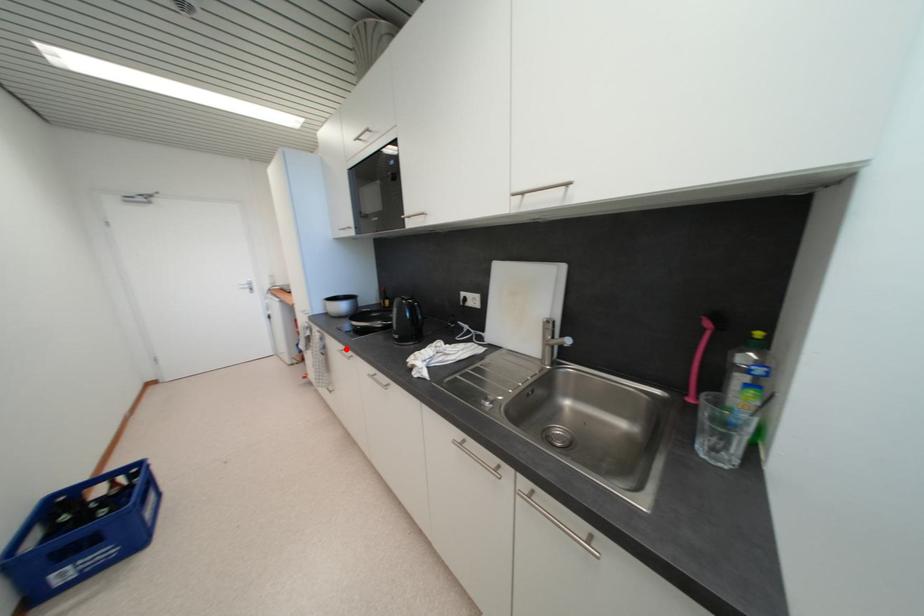
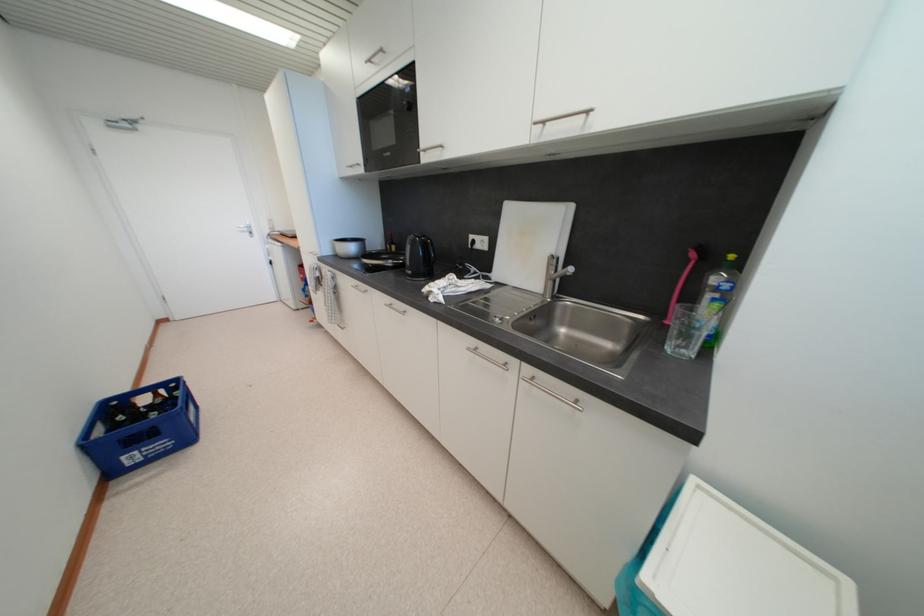
The point at the highlighted location is marked in the first image. Where is the corresponding point in the second image?

(359, 285)